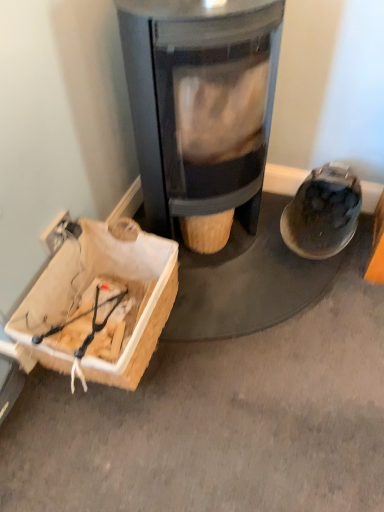
Locate an element on the screen. This screenshot has height=512, width=384. vacant area that lies in front of wooden crate at lower left is located at coordinates (118, 443).